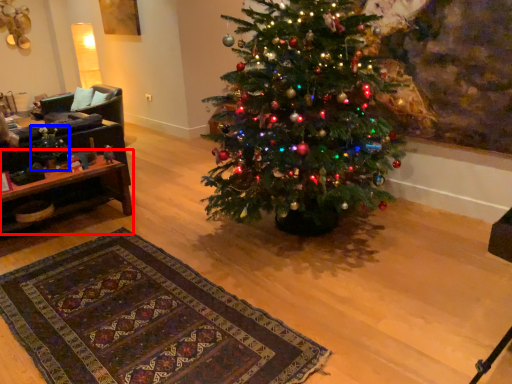
Question: Which of the following is the farthest to the observer, table (highlighted by a red box) or christmas decoration (highlighted by a blue box)?

Choices:
 (A) table
 (B) christmas decoration

Answer: (B)